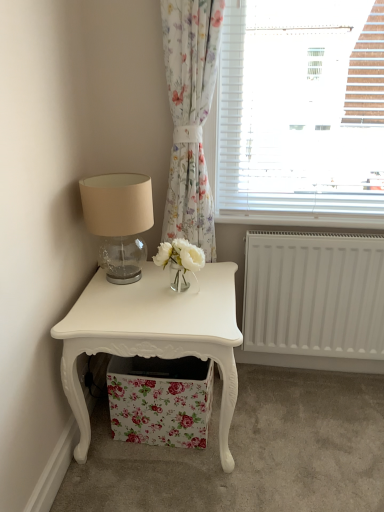
Where is `free space above white glossy nightstand at lower left (from a real-world perspective)`? This screenshot has width=384, height=512. free space above white glossy nightstand at lower left (from a real-world perspective) is located at coordinates (163, 294).